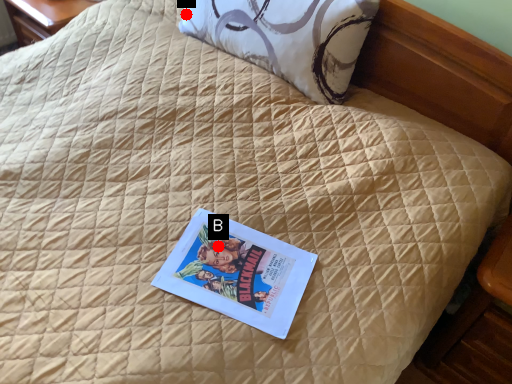
Question: Two points are circled on the image, labeled by A and B beside each circle. Which point appears farthest from the camera in this image?

Choices:
 (A) A is further
 (B) B is further

Answer: (A)